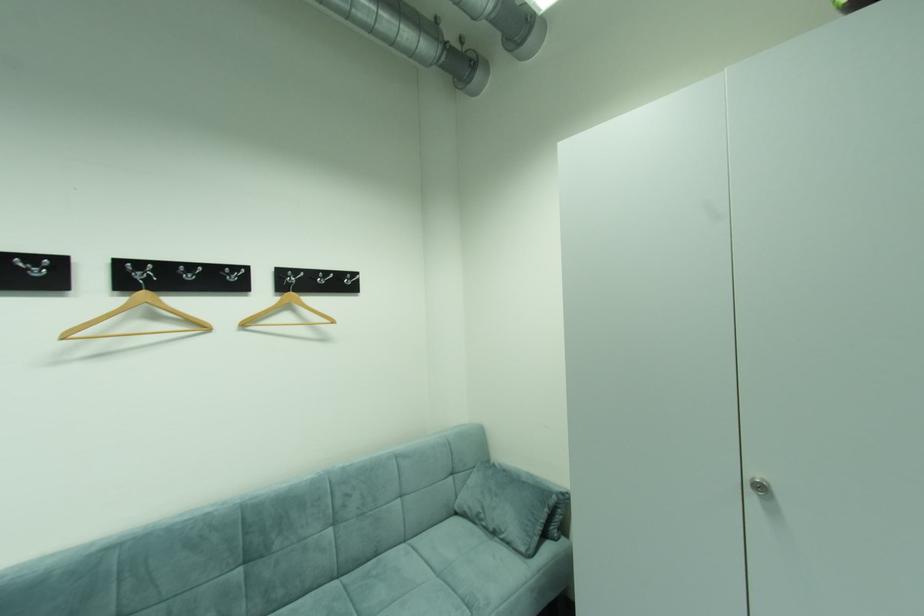
Find where to sit the sofa sitting surface. Please return your answer as a coordinate pair (x, y).

(383, 590)